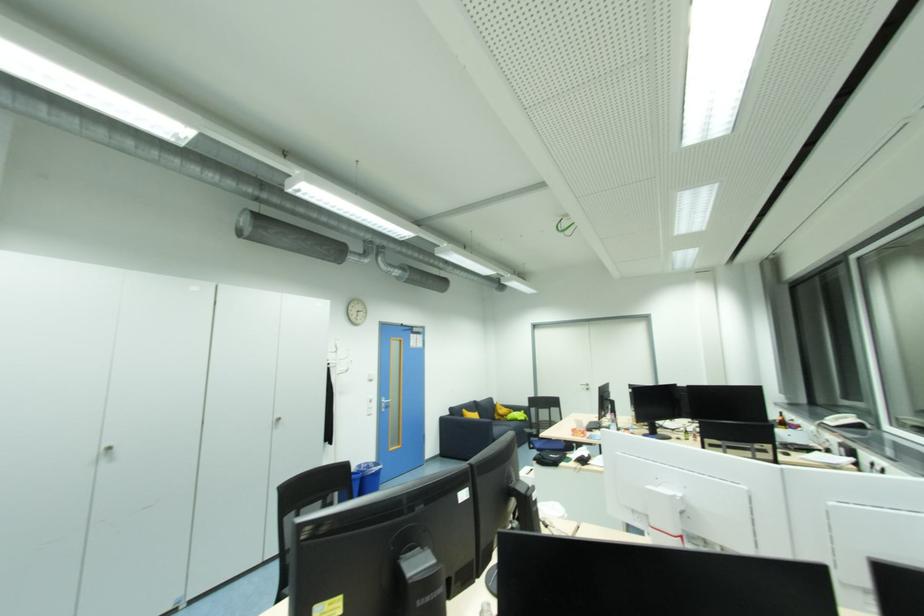
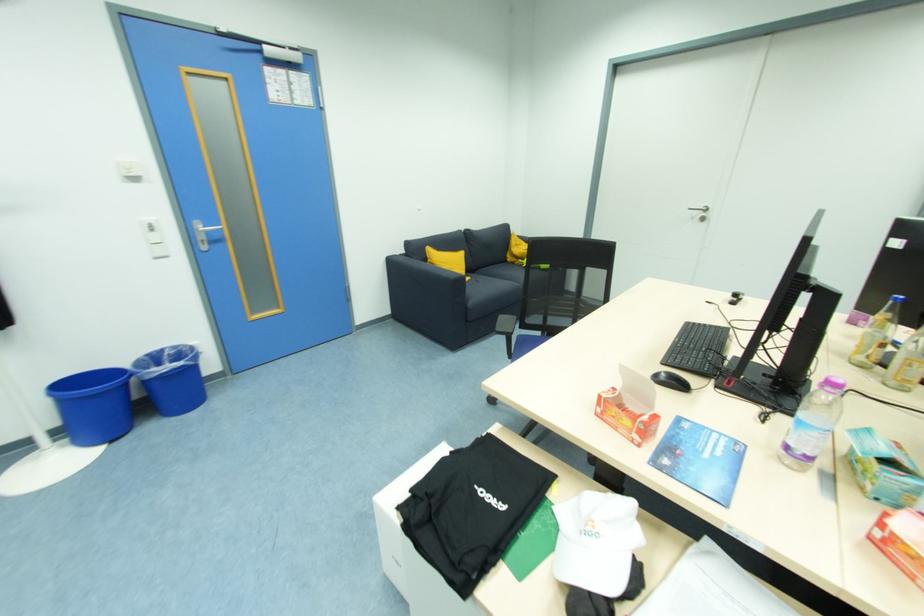
Where in the second image is the point corresponding to the point at 503,421 from the first image?

(516, 265)